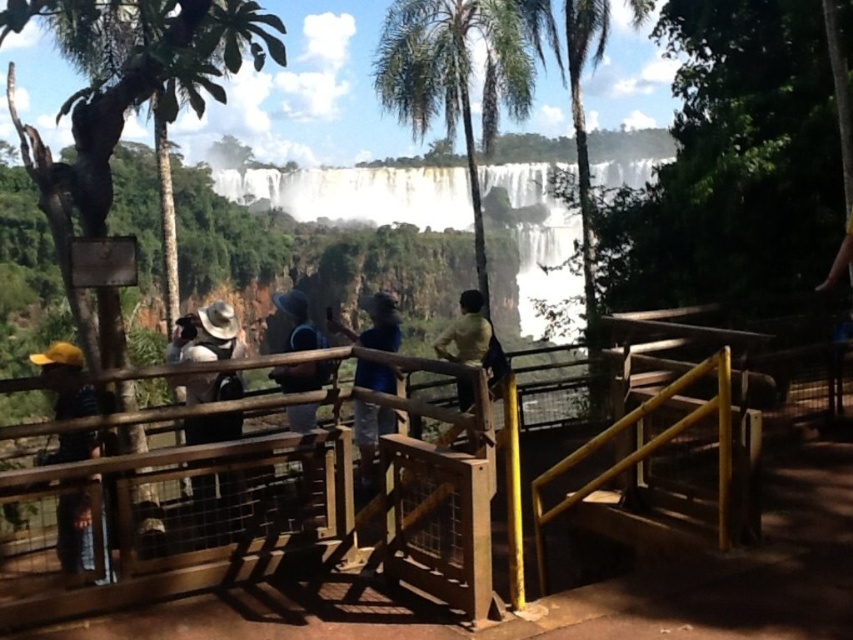
Is point (213, 323) farther from camera compared to point (57, 392)?

Yes, point (213, 323) is behind point (57, 392).

You are a GUI agent. You are given a task and a screenshot of the screen. Output one action in this format:
    pyautogui.click(x=<x>, y=<y>)
    Task: Click on the brown fabric hat at center
    This screenshot has height=640, width=853.
    Given the screenshot: What is the action you would take?
    pyautogui.click(x=207, y=336)

Where is `brown fabric hat at center`? Image resolution: width=853 pixels, height=640 pixels. brown fabric hat at center is located at coordinates (207, 336).

Measure the distance between white smooth waterfall at upper center and camera.

A distance of 16.44 meters exists between white smooth waterfall at upper center and camera.

I want to click on white smooth waterfall at upper center, so click(x=357, y=193).

Locate an element on the screen. Image resolution: width=853 pixels, height=640 pixels. white smooth waterfall at upper center is located at coordinates (357, 193).

Does brown fabric hat at center have a smaller size compared to blue fabric hat at center?

Indeed, brown fabric hat at center has a smaller size compared to blue fabric hat at center.

Is brown fabric hat at center positioned at the back of blue fabric hat at center?

Yes, it is.

Who is more forward, (204, 419) or (299, 305)?

Point (204, 419) is in front.

This screenshot has height=640, width=853. What are the coordinates of `brown fabric hat at center` in the screenshot? It's located at (207, 336).